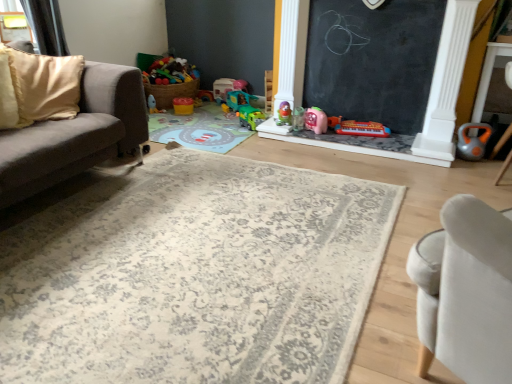
Question: Is there a large distance between translucent plastic cup at center, which appears as the 4th toy when viewed from the right, and yellow plastic cup at center, placed as the second toy when sorted from left to right?

Choices:
 (A) yes
 (B) no

Answer: (A)

Question: Does translucent plastic cup at center, the seventh toy from the left, contain yellow plastic cup at center, positioned as the ninth toy in right-to-left order?

Choices:
 (A) yes
 (B) no

Answer: (B)

Question: Could you tell me if translucent plastic cup at center, which appears as the 4th toy when viewed from the right, is facing yellow plastic cup at center, positioned as the ninth toy in right-to-left order?

Choices:
 (A) no
 (B) yes

Answer: (A)

Question: Can you confirm if translucent plastic cup at center, which appears as the 4th toy when viewed from the right, is smaller than yellow plastic cup at center, placed as the second toy when sorted from left to right?

Choices:
 (A) no
 (B) yes

Answer: (B)

Question: Is yellow plastic cup at center, placed as the second toy when sorted from left to right, at the back of translucent plastic cup at center, which appears as the 4th toy when viewed from the right?

Choices:
 (A) yes
 (B) no

Answer: (B)

Question: Is the surface of translucent plastic cup at center, which appears as the 4th toy when viewed from the right, in direct contact with yellow plastic cup at center, placed as the second toy when sorted from left to right?

Choices:
 (A) yes
 (B) no

Answer: (B)

Question: Can you confirm if orange rubber kettlebell at right, the tenth toy from the left, is bigger than matte plastic toy at upper center, the 10th toy positioned from the right?

Choices:
 (A) yes
 (B) no

Answer: (A)

Question: From the image's perspective, does orange rubber kettlebell at right, placed as the 1th toy when sorted from right to left, appear higher than matte plastic toy at upper center, which ranks as the 1th toy in left-to-right order?

Choices:
 (A) no
 (B) yes

Answer: (A)

Question: Is orange rubber kettlebell at right, the tenth toy from the left, touching matte plastic toy at upper center, which ranks as the 1th toy in left-to-right order?

Choices:
 (A) yes
 (B) no

Answer: (B)

Question: Does orange rubber kettlebell at right, placed as the 1th toy when sorted from right to left, have a lesser width compared to matte plastic toy at upper center, which ranks as the 1th toy in left-to-right order?

Choices:
 (A) no
 (B) yes

Answer: (A)

Question: Is matte plastic toy at upper center, which ranks as the 1th toy in left-to-right order, a part of orange rubber kettlebell at right, the tenth toy from the left?

Choices:
 (A) no
 (B) yes

Answer: (A)

Question: Is orange rubber kettlebell at right, the tenth toy from the left, oriented away from matte plastic toy at upper center, the 10th toy positioned from the right?

Choices:
 (A) no
 (B) yes

Answer: (A)

Question: From the image's perspective, is yellow plastic cup at center, positioned as the ninth toy in right-to-left order, above beige fabric couch at left?

Choices:
 (A) yes
 (B) no

Answer: (A)